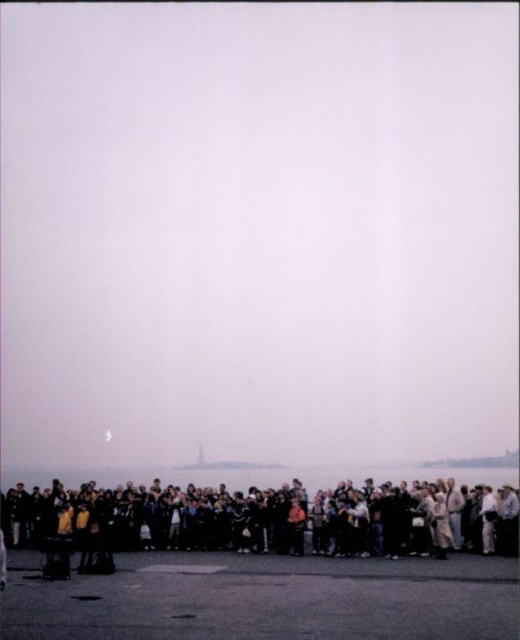
You are standing at the edge of the dark asphalt tarmac at lower center. If you walk straight forward, will you step onto the water or onto another surface?

The dark asphalt tarmac at lower center is positioned at point (x=265, y=598), so walking straight forward from there would lead you onto the water since the tarmac is at the edge near the water body.